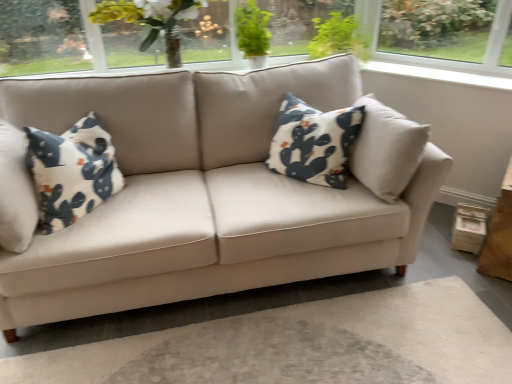
Question: From the image's perspective, is green leafy plant at upper center below wooden table at lower right?

Choices:
 (A) no
 (B) yes

Answer: (A)

Question: Considering the relative positions of green leafy plant at upper center and wooden table at lower right in the image provided, is green leafy plant at upper center to the left of wooden table at lower right from the viewer's perspective?

Choices:
 (A) no
 (B) yes

Answer: (B)

Question: From a real-world perspective, is green leafy plant at upper center positioned under wooden table at lower right based on gravity?

Choices:
 (A) no
 (B) yes

Answer: (A)

Question: Is green leafy plant at upper center bigger than wooden table at lower right?

Choices:
 (A) no
 (B) yes

Answer: (A)

Question: Are green leafy plant at upper center and wooden table at lower right far apart?

Choices:
 (A) yes
 (B) no

Answer: (A)

Question: Do you think wooden table at lower right is within green leafy plant at upper center, or outside of it?

Choices:
 (A) inside
 (B) outside

Answer: (B)

Question: Considering their positions, is wooden table at lower right located in front of or behind green leafy plant at upper center?

Choices:
 (A) behind
 (B) front

Answer: (B)

Question: Considering the positions of wooden table at lower right and green leafy plant at upper center in the image, is wooden table at lower right bigger or smaller than green leafy plant at upper center?

Choices:
 (A) small
 (B) big

Answer: (B)

Question: Considering the positions of wooden table at lower right and green leafy plant at upper center in the image, is wooden table at lower right taller or shorter than green leafy plant at upper center?

Choices:
 (A) short
 (B) tall

Answer: (B)

Question: In the image, is translucent glass vase at upper center positioned in front of or behind wooden table at lower right?

Choices:
 (A) front
 (B) behind

Answer: (B)

Question: Based on their positions, is translucent glass vase at upper center located to the left or right of wooden table at lower right?

Choices:
 (A) right
 (B) left

Answer: (B)

Question: From their relative heights in the image, would you say translucent glass vase at upper center is taller or shorter than wooden table at lower right?

Choices:
 (A) short
 (B) tall

Answer: (A)

Question: From a real-world perspective, relative to wooden table at lower right, is translucent glass vase at upper center vertically above or below?

Choices:
 (A) above
 (B) below

Answer: (A)

Question: Is point (133, 11) positioned closer to the camera than point (241, 13)?

Choices:
 (A) farther
 (B) closer

Answer: (B)

Question: Do you think translucent glass vase at upper center is within green leafy plant at upper center, or outside of it?

Choices:
 (A) inside
 (B) outside

Answer: (B)